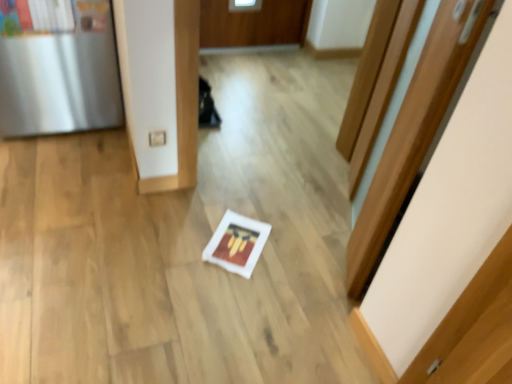
Where is `free space in front of white matte frame at center`? This screenshot has height=384, width=512. free space in front of white matte frame at center is located at coordinates (244, 300).